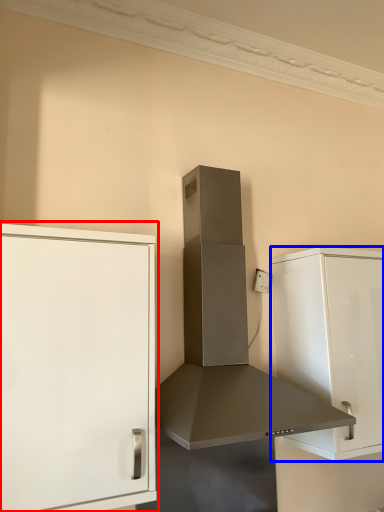
Question: Which object is closer to the camera taking this photo, cabinetry (highlighted by a red box) or cabinetry (highlighted by a blue box)?

Choices:
 (A) cabinetry
 (B) cabinetry

Answer: (A)